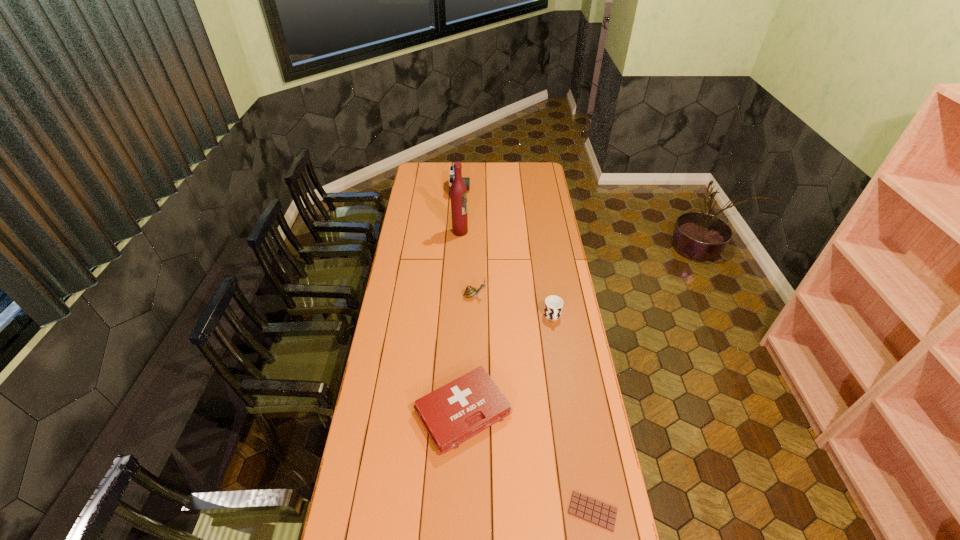
Point out which object is positioned as the nearest to the fourth tallest object. Please provide its 2D coordinates. Your answer should be formatted as a tuple, i.e. [(x, y)], where the tuple contains the x and y coordinates of a point satisfying the conditions above.

[(470, 291)]

The image size is (960, 540). Identify the location of object that is the fourth closest one to the shortest object. (458, 191).

This screenshot has width=960, height=540. Identify the location of free space that satisfies the following two spatial constraints: 1. on the label of the second farthest object; 2. on the left side of the second shortest object. (451, 411).

The height and width of the screenshot is (540, 960). In order to click on free spot that satisfies the following two spatial constraints: 1. on the back side of the fifth farthest object; 2. on the label of the tallest object in this screenshot , I will do pos(468,232).

Where is `free space that satisfies the following two spatial constraints: 1. on the back side of the candy bar; 2. on the label of the liquor`? The height and width of the screenshot is (540, 960). free space that satisfies the following two spatial constraints: 1. on the back side of the candy bar; 2. on the label of the liquor is located at coordinates (545, 232).